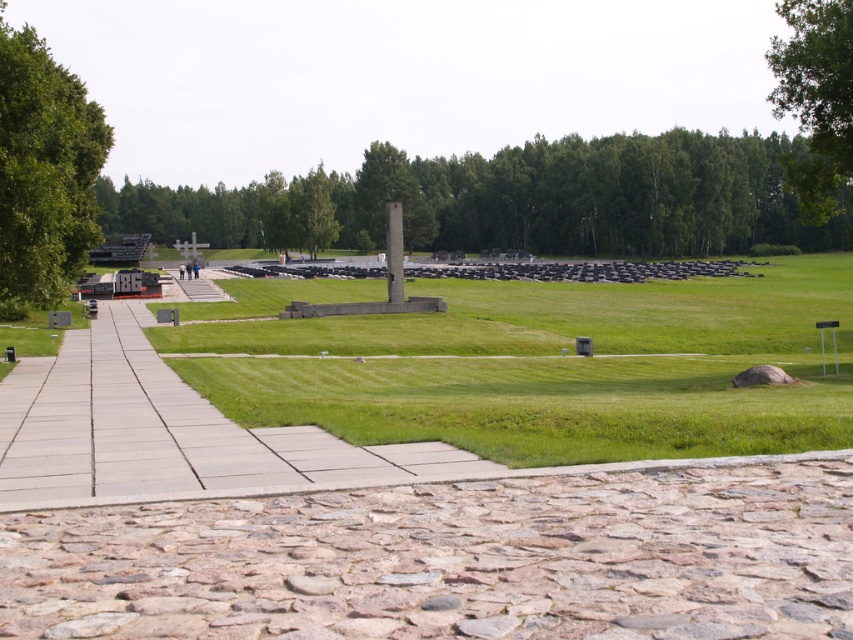
Does cobblestone pavement at lower center have a greater width compared to green leafy tree at center?

No.

Does cobblestone pavement at lower center have a larger size compared to green leafy tree at center?

No.

The image size is (853, 640). What do you see at coordinates (453, 560) in the screenshot?
I see `cobblestone pavement at lower center` at bounding box center [453, 560].

Where is `cobblestone pavement at lower center`? This screenshot has height=640, width=853. cobblestone pavement at lower center is located at coordinates (453, 560).

Does green leafy tree at left appear on the left side of smooth concrete column at center?

Correct, you'll find green leafy tree at left to the left of smooth concrete column at center.

Which of these two, green leafy tree at left or smooth concrete column at center, stands taller?

smooth concrete column at center is taller.

Locate an element on the screen. The height and width of the screenshot is (640, 853). green leafy tree at left is located at coordinates (44, 172).

This screenshot has height=640, width=853. I want to click on green leafy tree at left, so click(44, 172).

Which is above, green grass at center or green leafy tree at upper right?

green leafy tree at upper right

Does green grass at center appear on the right side of green leafy tree at upper right?

No, green grass at center is not to the right of green leafy tree at upper right.

You are a GUI agent. You are given a task and a screenshot of the screen. Output one action in this format:
    pyautogui.click(x=<x>, y=<y>)
    Task: Click on the green grass at center
    This screenshot has width=853, height=640.
    Given the screenshot: What is the action you would take?
    pyautogui.click(x=553, y=368)